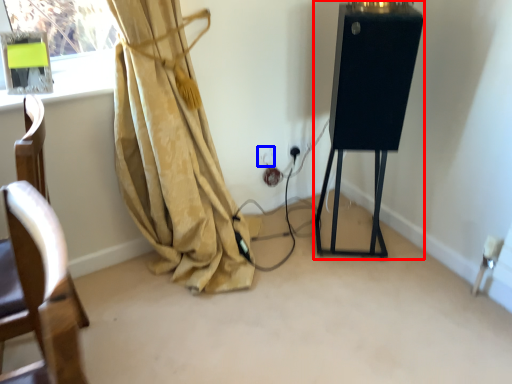
Question: Which object is further to the camera taking this photo, easel (highlighted by a red box) or electric outlet (highlighted by a blue box)?

Choices:
 (A) easel
 (B) electric outlet

Answer: (B)